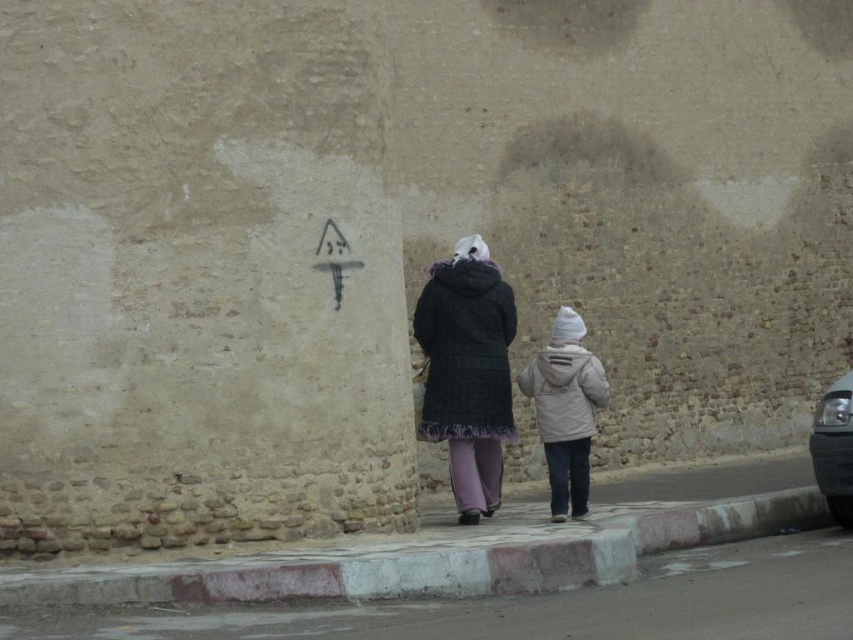
You are a photographer trying to capture both the smooth concrete pavement at lower center and the light beige fabric jacket at lower center in a single frame. Based on their sizes in the image, which object should you focus on first to ensure both are in focus?

The smooth concrete pavement at lower center has a smaller size compared to light beige fabric jacket at lower center. To ensure both are in focus, you should focus on the larger object, the light beige fabric jacket at lower center, since it will require more precise focusing due to its prominence in the frame.

You are a fashion designer observing two people walking away from you. You notice the plaid wool coat at center and the light beige fabric jacket at lower center. Which clothing item do you think is larger in size?

The plaid wool coat at center is bigger than the light beige fabric jacket at lower center, so the plaid wool coat at center is larger in size.